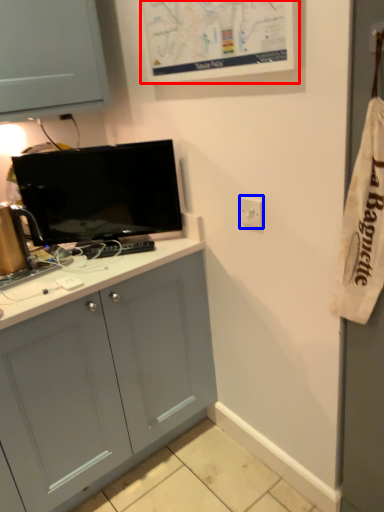
Question: Which of the following is the farthest to the observer, bulletin board (highlighted by a red box) or electric outlet (highlighted by a blue box)?

Choices:
 (A) bulletin board
 (B) electric outlet

Answer: (B)